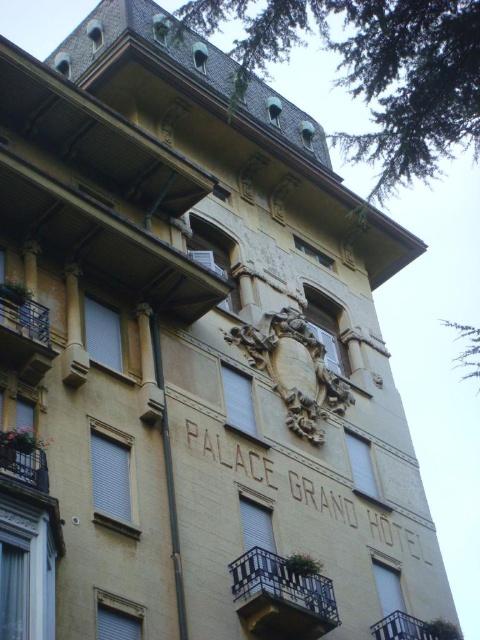
Question: Can you confirm if rustic wrought iron balcony at center is positioned above metallic blue balcony at left?

Choices:
 (A) no
 (B) yes

Answer: (A)

Question: Which object is closer to the camera taking this photo?

Choices:
 (A) metallic blue balcony at left
 (B) metallic balcony at lower right

Answer: (A)

Question: Which of the following is the closest to the observer?

Choices:
 (A) (19, 465)
 (B) (303, 596)

Answer: (A)

Question: Which object is positioned farthest from the rustic wrought iron balcony at lower left?

Choices:
 (A) metallic blue balcony at left
 (B) metallic balcony at lower right

Answer: (B)

Question: Is rustic wrought iron balcony at center positioned before metallic balcony at lower right?

Choices:
 (A) yes
 (B) no

Answer: (A)

Question: Observing the image, what is the correct spatial positioning of metallic blue balcony at left in reference to rustic wrought iron balcony at lower left?

Choices:
 (A) below
 (B) above

Answer: (B)